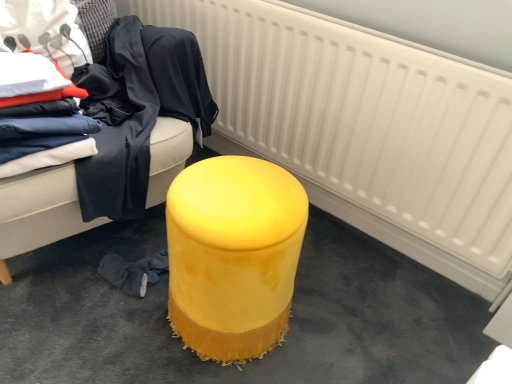
Question: From the image's perspective, relative to velvet fabric clothes at left, the second clothing when ordered from left to right, is matte white fabric at upper left, the first clothing positioned from the left, above or below?

Choices:
 (A) below
 (B) above

Answer: (B)

Question: Considering the positions of matte white fabric at upper left, the first clothing positioned from the left, and velvet fabric clothes at left, placed as the 3th clothing when sorted from right to left, in the image, is matte white fabric at upper left, the first clothing positioned from the left, wider or thinner than velvet fabric clothes at left, placed as the 3th clothing when sorted from right to left,?

Choices:
 (A) wide
 (B) thin

Answer: (B)

Question: Which of these objects is positioned closest to the white textured radiator at center?

Choices:
 (A) velvet fabric clothes at left, placed as the 3th clothing when sorted from right to left
 (B) dark blue fabric at left, which ranks as the 4th clothing in left-to-right order
 (C) velvet yellow stool at center
 (D) matte white fabric at upper left, the first clothing positioned from the left
 (E) velvet yellow ottoman at center

Answer: (B)

Question: Which is nearer to the velvet fabric clothes at left, the second clothing when ordered from left to right?

Choices:
 (A) dark blue fabric at left, which ranks as the 2th clothing in right-to-left order
 (B) matte white fabric at upper left, placed as the fourth clothing when sorted from right to left
 (C) velvet yellow ottoman at center
 (D) white textured radiator at center
 (E) dark blue fabric at left, which ranks as the 4th clothing in left-to-right order

Answer: (A)